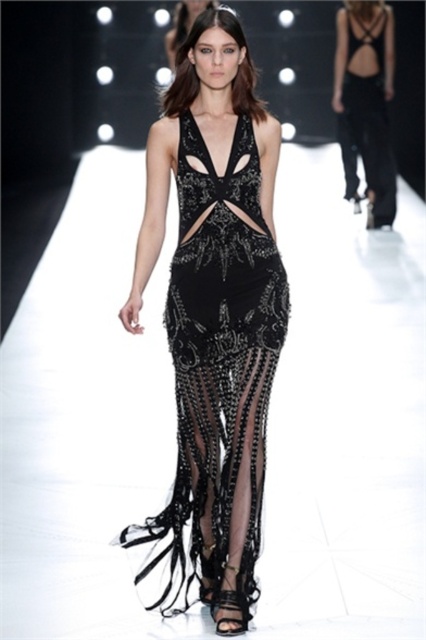
At what (x,y) coordinates should I click in order to perform the action: click on black sheer dress at center. Please return your answer as a coordinate pair (x, y). Looking at the image, I should click on (365, 100).

Is point (377, 224) closer to camera compared to point (244, 628)?

No, (377, 224) is behind (244, 628).

Locate an element on the screen. black sheer dress at center is located at coordinates (365, 100).

Between point (212, 604) and point (190, 19), which one is positioned in front?

Point (212, 604) is more forward.

Is point (232, 627) positioned behind point (176, 26)?

No.

Between point (233, 605) and point (178, 48), which one is positioned behind?

Positioned behind is point (178, 48).

You are a GUI agent. You are given a task and a screenshot of the screen. Output one action in this format:
    pyautogui.click(x=<x>, y=<y>)
    Task: Click on the black leather sandal at center
    This screenshot has width=426, height=640.
    Given the screenshot: What is the action you would take?
    pyautogui.click(x=230, y=611)

Can you confirm if black sheer dress at center is bigger than satin black dress at center?

Correct, black sheer dress at center is larger in size than satin black dress at center.

Is point (385, 54) closer to viewer compared to point (189, 19)?

That is True.

Identify the location of black sheer dress at center. (365, 100).